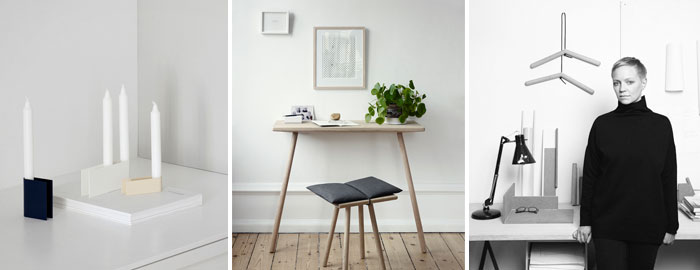
Identify the location of spindle legs. The width and height of the screenshot is (700, 270). (283, 191), (427, 180), (336, 250), (354, 259), (369, 236), (391, 255), (479, 262), (498, 251).